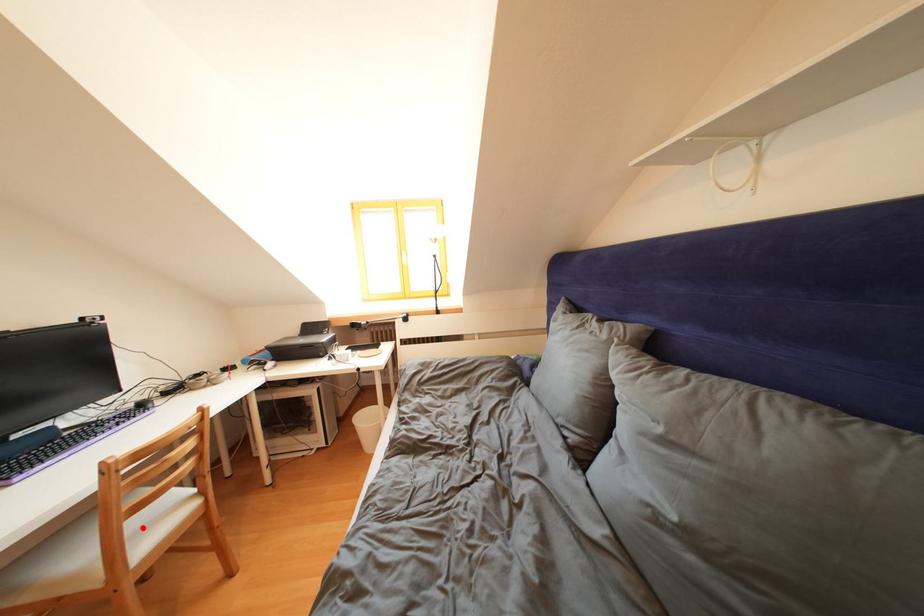
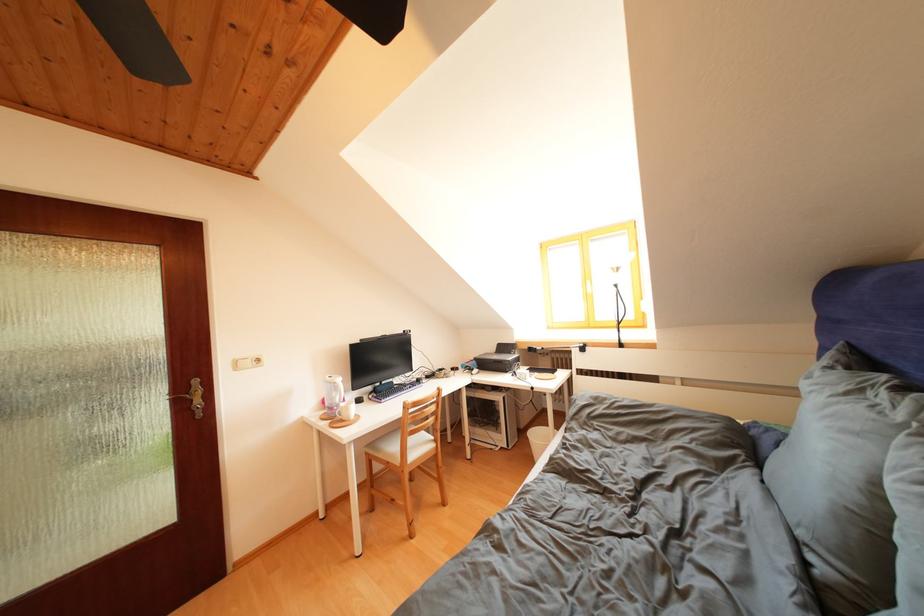
Locate, in the second image, the point that corresponds to the highlighted location in the first image.

(419, 446)